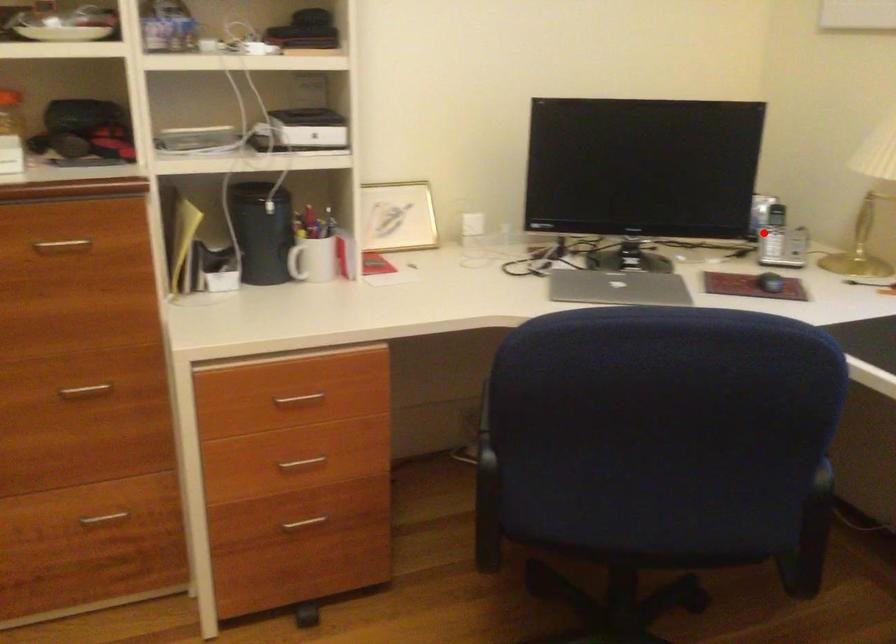
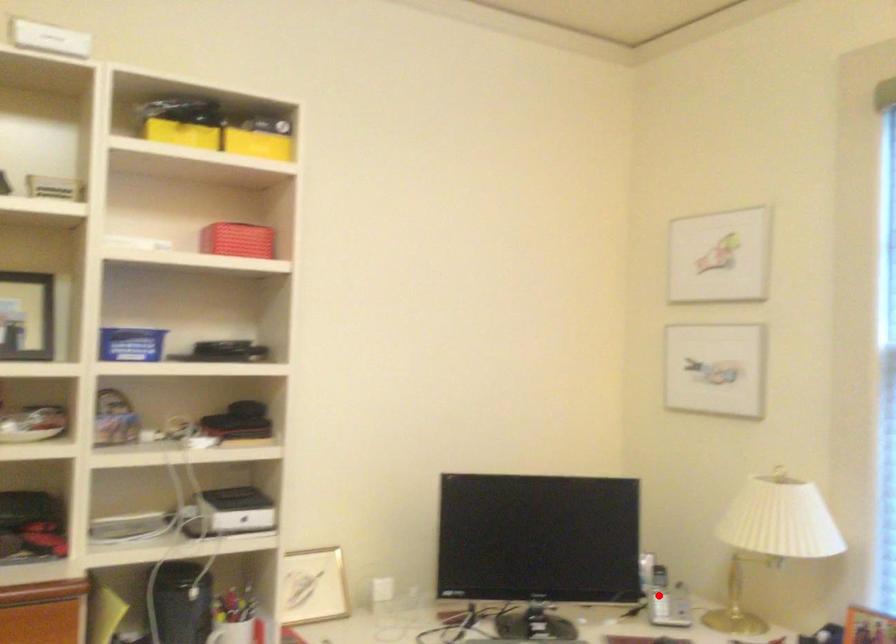
I am providing you with two images of the same scene from different viewpoints. A red point is marked on the first image and another point is marked on the second image. Does the point marked in image1 correspond to the same location as the one in image2?

Yes